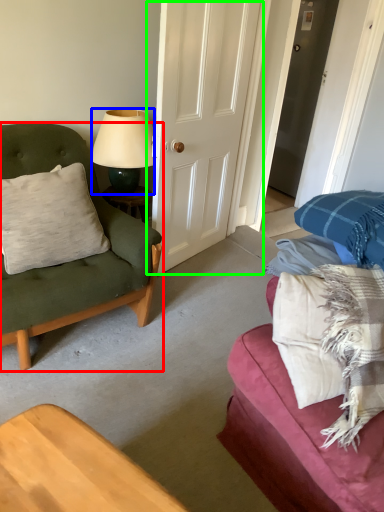
Question: Which is nearer to the chair (highlighted by a red box)? lamp (highlighted by a blue box) or door (highlighted by a green box).

Choices:
 (A) lamp
 (B) door

Answer: (A)